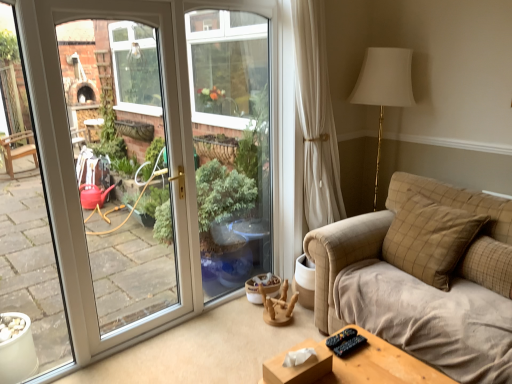
Question: Does brown velvety pillow at right, which is counted as the 1th pillow, starting from the left, have a greater width compared to brown checkered pillow at right, which appears as the first pillow when viewed from the right?

Choices:
 (A) no
 (B) yes

Answer: (B)

Question: Can you see brown velvety pillow at right, which is the 2th pillow in right-to-left order, touching brown checkered pillow at right, positioned as the second pillow in left-to-right order?

Choices:
 (A) yes
 (B) no

Answer: (B)

Question: Considering the relative sizes of brown velvety pillow at right, which is counted as the 1th pillow, starting from the left, and brown checkered pillow at right, which appears as the first pillow when viewed from the right, in the image provided, is brown velvety pillow at right, which is counted as the 1th pillow, starting from the left, smaller than brown checkered pillow at right, which appears as the first pillow when viewed from the right,?

Choices:
 (A) no
 (B) yes

Answer: (A)

Question: Are brown velvety pillow at right, which is the 2th pillow in right-to-left order, and brown checkered pillow at right, positioned as the second pillow in left-to-right order, far apart?

Choices:
 (A) yes
 (B) no

Answer: (B)

Question: Is brown velvety pillow at right, which is the 2th pillow in right-to-left order, to the left of brown checkered pillow at right, which appears as the first pillow when viewed from the right, from the viewer's perspective?

Choices:
 (A) no
 (B) yes

Answer: (B)

Question: Could brown checkered pillow at right, which appears as the first pillow when viewed from the right, be considered to be inside brown velvety pillow at right, which is counted as the 1th pillow, starting from the left?

Choices:
 (A) yes
 (B) no

Answer: (B)

Question: Is brown checkered pillow at right, which appears as the first pillow when viewed from the right, turned away from brown velvety pillow at right, which is the 2th pillow in right-to-left order?

Choices:
 (A) no
 (B) yes

Answer: (A)

Question: Is brown velvety pillow at right, which is counted as the 1th pillow, starting from the left, located within brown checkered pillow at right, which appears as the first pillow when viewed from the right?

Choices:
 (A) no
 (B) yes

Answer: (A)

Question: Is brown checkered pillow at right, which appears as the first pillow when viewed from the right, beside brown velvety pillow at right, which is the 2th pillow in right-to-left order?

Choices:
 (A) no
 (B) yes

Answer: (A)

Question: Considering the relative positions of brown checkered pillow at right, which appears as the first pillow when viewed from the right, and brown velvety pillow at right, which is the 2th pillow in right-to-left order, in the image provided, is brown checkered pillow at right, which appears as the first pillow when viewed from the right, behind brown velvety pillow at right, which is the 2th pillow in right-to-left order,?

Choices:
 (A) no
 (B) yes

Answer: (A)

Question: Is brown checkered pillow at right, positioned as the second pillow in left-to-right order, outside brown velvety pillow at right, which is the 2th pillow in right-to-left order?

Choices:
 (A) no
 (B) yes

Answer: (B)

Question: Is brown checkered pillow at right, positioned as the second pillow in left-to-right order, smaller than brown velvety pillow at right, which is the 2th pillow in right-to-left order?

Choices:
 (A) yes
 (B) no

Answer: (A)

Question: In the image, is brown checkered pillow at right, positioned as the second pillow in left-to-right order, positioned in front of or behind brown velvety pillow at right, which is the 2th pillow in right-to-left order?

Choices:
 (A) front
 (B) behind

Answer: (A)